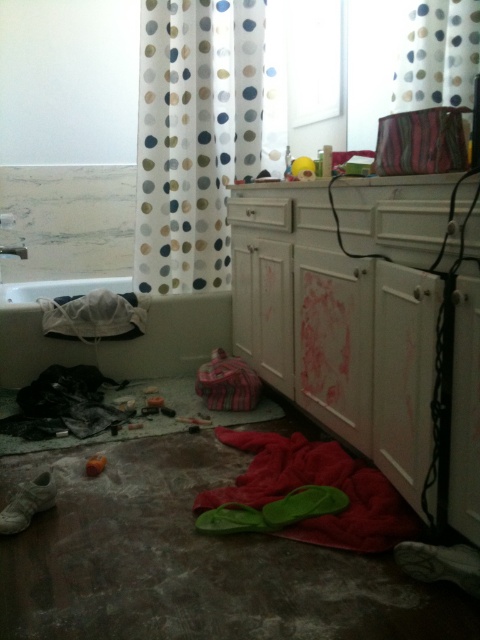
Question: Can you confirm if white glossy vanity at lower right is bigger than red fabric at lower center?

Choices:
 (A) no
 (B) yes

Answer: (B)

Question: Where is red fabric at lower center located in relation to white dotted fabric at upper center in the image?

Choices:
 (A) right
 (B) left

Answer: (B)

Question: Which of the following is the farthest from the observer?

Choices:
 (A) (443, 29)
 (B) (188, 312)

Answer: (B)

Question: Which point appears farthest from the camera in this image?

Choices:
 (A) (451, 74)
 (B) (197, 307)
 (C) (272, 499)
 (D) (204, 244)

Answer: (D)

Question: Which of the following is the closest to the observer?

Choices:
 (A) (411, 81)
 (B) (144, 368)
 (C) (253, 308)

Answer: (A)

Question: Can you confirm if polka dot fabric shower curtain at upper center is positioned to the right of red fabric at lower center?

Choices:
 (A) no
 (B) yes

Answer: (A)